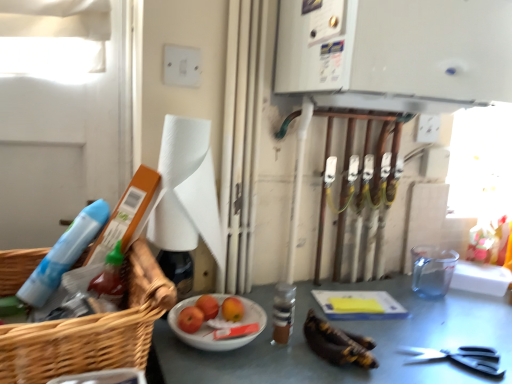
Identify the location of vacant space situated above metallic gray table at center (from a real-world perspective). This screenshot has width=512, height=384. (376, 329).